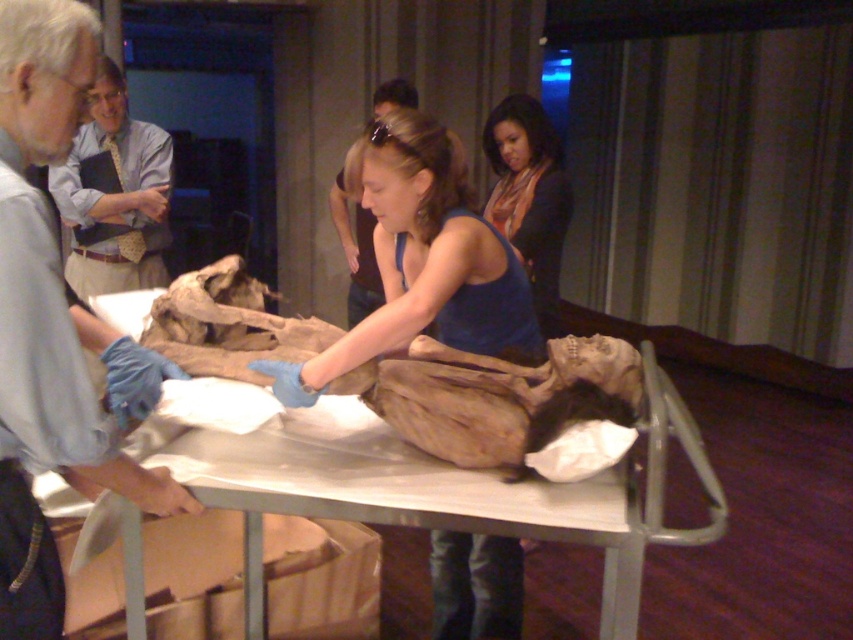
Question: Does matte blue tank top at center appear on the right side of blue latex glove at center?

Choices:
 (A) no
 (B) yes

Answer: (B)

Question: Is blue fabric shirt at center wider than matte blue tank top at center?

Choices:
 (A) yes
 (B) no

Answer: (A)

Question: Which point is farther from the camera taking this photo?

Choices:
 (A) (79, 452)
 (B) (509, 93)
 (C) (663, 544)

Answer: (B)

Question: Among these points, which one is nearest to the camera?

Choices:
 (A) (428, 260)
 (B) (45, 442)
 (C) (596, 516)
 (D) (491, 220)

Answer: (B)

Question: Can you confirm if metallic silver table at center is positioned to the right of blue fabric shirt at center?

Choices:
 (A) yes
 (B) no

Answer: (A)

Question: Among these objects, which one is nearest to the camera?

Choices:
 (A) matte blue tank top at center
 (B) gray fabric apron at left

Answer: (B)